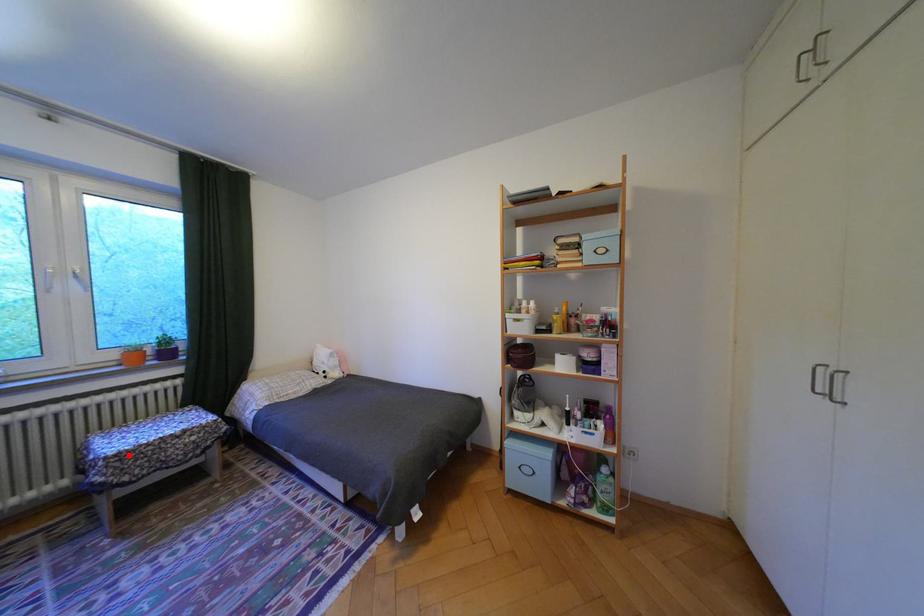
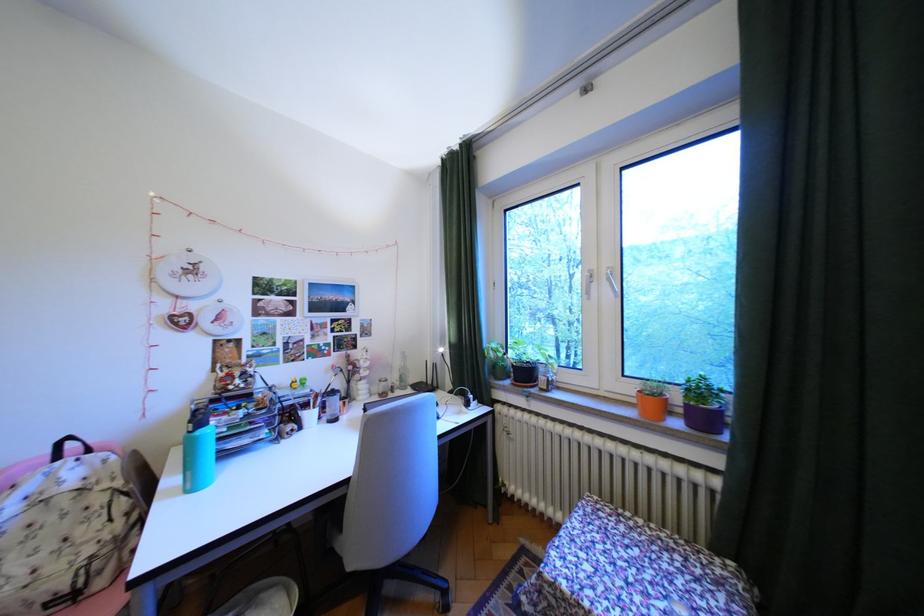
Question: A red point is marked in image1. In image2, is the corresponding 3D point closer to the camera or farther? Reply with the corresponding letter.

Choices:
 (A) The corresponding 3D point is closer.
 (B) The corresponding 3D point is farther.

Answer: (B)